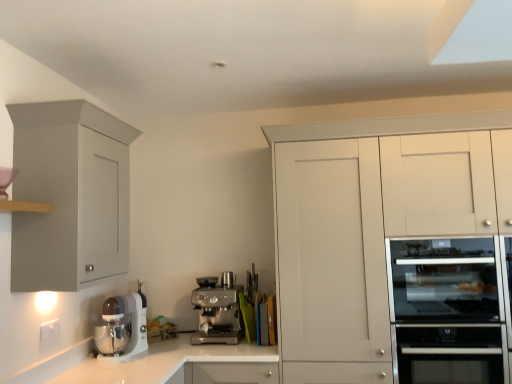
Find the location of a particular element. The height and width of the screenshot is (384, 512). stainless steel oven at right is located at coordinates (449, 354).

Measure the distance between point (461, 264) and camera.

Point (461, 264) is 2.28 meters from camera.

Find the location of `matte gray cabinet at left, acting as the first cabinetry starting from the left`. matte gray cabinet at left, acting as the first cabinetry starting from the left is located at coordinates (69, 195).

In order to click on white glossy countertop at center in this screenshot , I will do `click(170, 362)`.

The image size is (512, 384). What do you see at coordinates (122, 327) in the screenshot?
I see `white glossy stand mixer at lower left, positioned as the 2th kitchen appliance in back-to-front order` at bounding box center [122, 327].

Describe the element at coordinates (218, 313) in the screenshot. I see `satin silver metallic espresso machine at center, placed as the 2th kitchen appliance when sorted from left to right` at that location.

This screenshot has height=384, width=512. I want to click on stainless steel oven at right, so click(449, 354).

From the image's perspective, is white matte cabinet at right, the second cabinetry when ordered from left to right, located above stainless steel oven at right?

Yes, from the image's perspective, white matte cabinet at right, the second cabinetry when ordered from left to right, is above stainless steel oven at right.

Based on their sizes in the image, would you say white matte cabinet at right, the first cabinetry in the right-to-left sequence, is bigger or smaller than stainless steel oven at right?

In the image, white matte cabinet at right, the first cabinetry in the right-to-left sequence, appears to be larger than stainless steel oven at right.

Is white matte cabinet at right, the first cabinetry in the right-to-left sequence, closer to camera compared to stainless steel oven at right?

Yes, white matte cabinet at right, the first cabinetry in the right-to-left sequence, is closer to the camera.

Would you consider white matte cabinet at right, the first cabinetry in the right-to-left sequence, to be distant from stainless steel oven at right?

They are positioned close to each other.

Measure the distance from satin silver oven at right to satin silver metallic espresso machine at center, positioned as the second kitchen appliance in front-to-back order.

The distance of satin silver oven at right from satin silver metallic espresso machine at center, positioned as the second kitchen appliance in front-to-back order, is 3.83 feet.

Which is correct: satin silver oven at right is inside satin silver metallic espresso machine at center, placed as the 2th kitchen appliance when sorted from left to right, or outside of it?

satin silver oven at right lies outside satin silver metallic espresso machine at center, placed as the 2th kitchen appliance when sorted from left to right.

Is satin silver oven at right thinner than satin silver metallic espresso machine at center, placed as the 2th kitchen appliance when sorted from left to right?

In fact, satin silver oven at right might be wider than satin silver metallic espresso machine at center, placed as the 2th kitchen appliance when sorted from left to right.

Between satin silver oven at right and white glossy stand mixer at lower left, positioned as the 2th kitchen appliance in back-to-front order, which one is positioned in front?

satin silver oven at right is more forward.

Does point (482, 320) come farther from viewer compared to point (106, 338)?

No, (482, 320) is closer to viewer.

Between satin silver oven at right and white glossy stand mixer at lower left, positioned as the 2th kitchen appliance in back-to-front order, which one has smaller width?

Thinner between the two is white glossy stand mixer at lower left, positioned as the 2th kitchen appliance in back-to-front order.

Would you say white glossy stand mixer at lower left, the second kitchen appliance when ordered from right to left, is inside or outside white matte cabinet at right, the second cabinetry when ordered from left to right?

white glossy stand mixer at lower left, the second kitchen appliance when ordered from right to left, is not enclosed by white matte cabinet at right, the second cabinetry when ordered from left to right.

Can you confirm if white glossy stand mixer at lower left, the second kitchen appliance when ordered from right to left, is positioned to the left of white matte cabinet at right, the first cabinetry in the right-to-left sequence?

Yes, white glossy stand mixer at lower left, the second kitchen appliance when ordered from right to left, is to the left of white matte cabinet at right, the first cabinetry in the right-to-left sequence.

Which object is wider, white glossy stand mixer at lower left, the second kitchen appliance when ordered from right to left, or white matte cabinet at right, the first cabinetry in the right-to-left sequence?

white matte cabinet at right, the first cabinetry in the right-to-left sequence, is wider.

Who is taller, white glossy stand mixer at lower left, the first kitchen appliance when ordered from left to right, or white matte cabinet at right, the second cabinetry when ordered from left to right?

With more height is white matte cabinet at right, the second cabinetry when ordered from left to right.

Is the surface of satin silver oven at right in direct contact with white glossy countertop at center?

No, satin silver oven at right is not beside white glossy countertop at center.

Is satin silver oven at right facing away from white glossy countertop at center?

No, satin silver oven at right's orientation is not away from white glossy countertop at center.

From a real-world perspective, is satin silver oven at right on white glossy countertop at center?

Yes, from a real-world perspective, satin silver oven at right is above white glossy countertop at center.

Is point (481, 258) closer or farther from the camera than point (162, 350)?

Point (481, 258) appears to be closer to the viewer than point (162, 350).

Identify the location of the 2nd kitchen appliance behind the satin silver oven at right. This screenshot has width=512, height=384. (218, 313).

Which object is closer to the camera, satin silver metallic espresso machine at center, positioned as the second kitchen appliance in front-to-back order, or satin silver oven at right?

satin silver oven at right is in front.

Looking at the image, does satin silver metallic espresso machine at center, which ranks as the first kitchen appliance in right-to-left order, seem bigger or smaller compared to satin silver oven at right?

Considering their sizes, satin silver metallic espresso machine at center, which ranks as the first kitchen appliance in right-to-left order, takes up less space than satin silver oven at right.

Is satin silver metallic espresso machine at center, positioned as the second kitchen appliance in front-to-back order, wider or thinner than satin silver oven at right?

Clearly, satin silver metallic espresso machine at center, positioned as the second kitchen appliance in front-to-back order, has less width compared to satin silver oven at right.

Is stainless steel oven at right spatially inside white glossy stand mixer at lower left, the second kitchen appliance when ordered from right to left, or outside of it?

stainless steel oven at right is located beyond the bounds of white glossy stand mixer at lower left, the second kitchen appliance when ordered from right to left.

Between stainless steel oven at right and white glossy stand mixer at lower left, the first kitchen appliance when ordered from left to right, which one has larger size?

With larger size is stainless steel oven at right.

In terms of height, does stainless steel oven at right look taller or shorter compared to white glossy stand mixer at lower left, positioned as the first kitchen appliance in front-to-back order?

Considering their sizes, stainless steel oven at right has more height than white glossy stand mixer at lower left, positioned as the first kitchen appliance in front-to-back order.

Where is `oven located underneath the white matte cabinet at right, the first cabinetry in the right-to-left sequence (from a real-world perspective)`? This screenshot has height=384, width=512. oven located underneath the white matte cabinet at right, the first cabinetry in the right-to-left sequence (from a real-world perspective) is located at coordinates (449, 354).

Locate an element on the screen. home appliance above the satin silver metallic espresso machine at center, positioned as the second kitchen appliance in front-to-back order (from the image's perspective) is located at coordinates (446, 311).

Looking at the image, which one is located closer to matte gray cabinet at left, which is counted as the 2th cabinetry, starting from the right, white matte cabinet at right, the first cabinetry in the right-to-left sequence, or stainless steel oven at right?

white matte cabinet at right, the first cabinetry in the right-to-left sequence, lies closer to matte gray cabinet at left, which is counted as the 2th cabinetry, starting from the right, than the other object.

From the image, which object appears to be nearer to satin silver oven at right, white matte cabinet at right, the second cabinetry when ordered from left to right, or stainless steel oven at right?

stainless steel oven at right lies closer to satin silver oven at right than the other object.

Which object lies further to the anchor point stainless steel oven at right, satin silver metallic espresso machine at center, the first kitchen appliance in the back-to-front sequence, or white glossy countertop at center?

Among the two, satin silver metallic espresso machine at center, the first kitchen appliance in the back-to-front sequence, is located further to stainless steel oven at right.

From the picture: From the image, which object appears to be nearer to satin silver oven at right, white glossy stand mixer at lower left, the first kitchen appliance when ordered from left to right, or satin silver metallic espresso machine at center, placed as the 2th kitchen appliance when sorted from left to right?

satin silver metallic espresso machine at center, placed as the 2th kitchen appliance when sorted from left to right, is closer to satin silver oven at right.

Based on their spatial positions, is white glossy countertop at center or stainless steel oven at right further from satin silver metallic espresso machine at center, the first kitchen appliance in the back-to-front sequence?

Based on the image, stainless steel oven at right appears to be further to satin silver metallic espresso machine at center, the first kitchen appliance in the back-to-front sequence.

Looking at this image, considering their positions, is white matte cabinet at right, the second cabinetry when ordered from left to right, positioned further to white glossy stand mixer at lower left, positioned as the first kitchen appliance in front-to-back order, than satin silver metallic espresso machine at center, the first kitchen appliance in the back-to-front sequence?

white matte cabinet at right, the second cabinetry when ordered from left to right, lies further to white glossy stand mixer at lower left, positioned as the first kitchen appliance in front-to-back order, than the other object.

Based on their spatial positions, is satin silver metallic espresso machine at center, positioned as the second kitchen appliance in front-to-back order, or matte gray cabinet at left, which is counted as the 2th cabinetry, starting from the right, further from satin silver oven at right?

matte gray cabinet at left, which is counted as the 2th cabinetry, starting from the right.

Based on their spatial positions, is satin silver metallic espresso machine at center, placed as the 2th kitchen appliance when sorted from left to right, or white glossy countertop at center closer to white matte cabinet at right, the second cabinetry when ordered from left to right?

Based on the image, satin silver metallic espresso machine at center, placed as the 2th kitchen appliance when sorted from left to right, appears to be nearer to white matte cabinet at right, the second cabinetry when ordered from left to right.

Where is `home appliance between white glossy countertop at center and stainless steel oven at right from left to right`? home appliance between white glossy countertop at center and stainless steel oven at right from left to right is located at coordinates (446, 311).

Where is `home appliance located between satin silver metallic espresso machine at center, the first kitchen appliance in the back-to-front sequence, and stainless steel oven at right in the left-right direction`? home appliance located between satin silver metallic espresso machine at center, the first kitchen appliance in the back-to-front sequence, and stainless steel oven at right in the left-right direction is located at coordinates (446, 311).

I want to click on kitchen appliance located between white glossy stand mixer at lower left, the first kitchen appliance when ordered from left to right, and satin silver oven at right in the left-right direction, so click(x=218, y=313).

The height and width of the screenshot is (384, 512). I want to click on cabinetry situated between satin silver metallic espresso machine at center, positioned as the second kitchen appliance in front-to-back order, and satin silver oven at right from left to right, so click(369, 140).